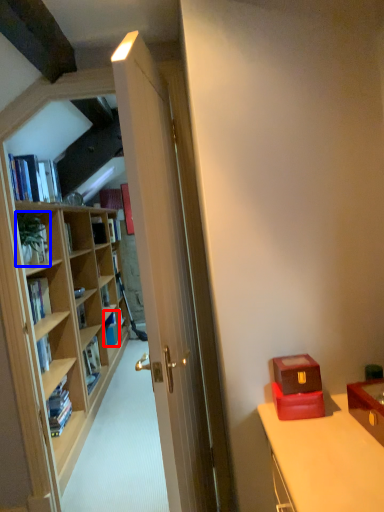
Question: Which object appears farthest to the camera in this image, book (highlighted by a red box) or houseplant (highlighted by a blue box)?

Choices:
 (A) book
 (B) houseplant

Answer: (A)